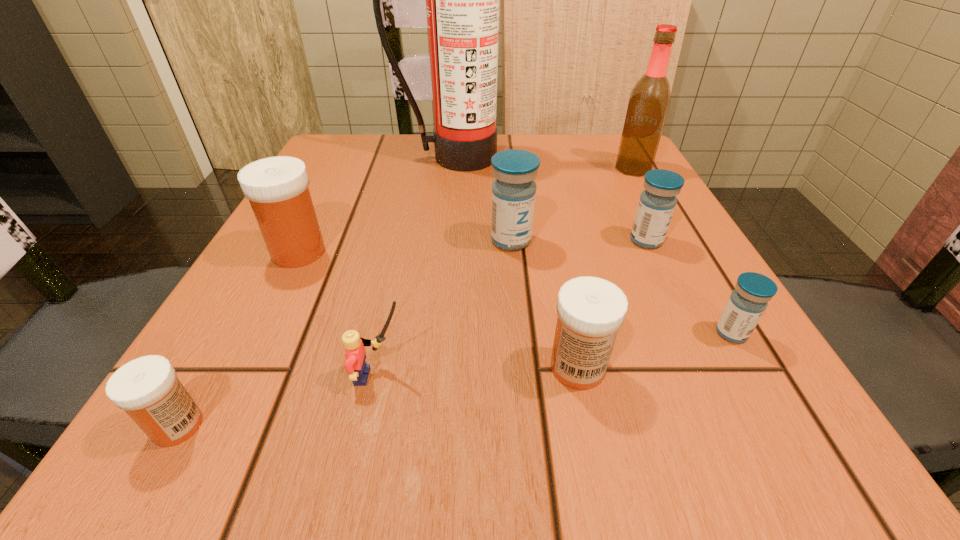
At what (x,y) coordinates should I click in order to perform the action: click on the second closest blue medicine to the biggest white medicine. Please return your answer as a coordinate pair (x, y). This screenshot has width=960, height=540. Looking at the image, I should click on (657, 202).

I want to click on white medicine object that ranks as the second closest to the smallest blue medicine, so click(277, 188).

The image size is (960, 540). Find the location of `white medicine that is the closest to the farthest white medicine`. white medicine that is the closest to the farthest white medicine is located at coordinates (147, 388).

I want to click on vacant region that satisfies the following two spatial constraints: 1. on the front-facing side of the fire extinguisher; 2. on the left side of the biggest blue medicine, so click(x=444, y=240).

You are a GUI agent. You are given a task and a screenshot of the screen. Output one action in this format:
    pyautogui.click(x=<x>, y=<y>)
    Task: Click on the free space in the image that satisfies the following two spatial constraints: 1. on the front-facing side of the fire extinguisher; 2. on the left side of the fifth medicine from left to right
    The image size is (960, 540).
    Given the screenshot: What is the action you would take?
    pyautogui.click(x=444, y=240)

Identify the location of blank area in the image that satisfies the following two spatial constraints: 1. on the back side of the nearest medicine; 2. on the left side of the leftmost blue medicine. The width and height of the screenshot is (960, 540). (283, 240).

The width and height of the screenshot is (960, 540). I want to click on free point that satisfies the following two spatial constraints: 1. on the front-facing side of the red fire extinguisher; 2. on the right side of the fifth medicine from left to right, so click(444, 240).